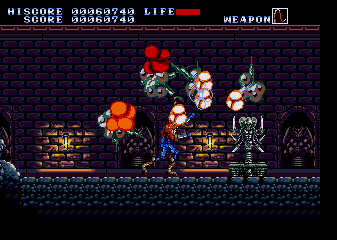
The image size is (337, 240). What are the coordinates of `brick wall` in the screenshot? It's located at (104, 69).